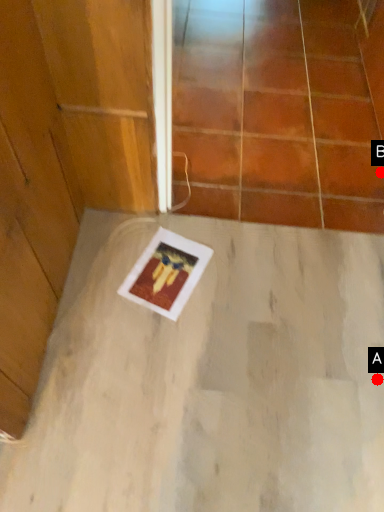
Question: Two points are circled on the image, labeled by A and B beside each circle. Which point is closer to the camera?

Choices:
 (A) A is closer
 (B) B is closer

Answer: (A)